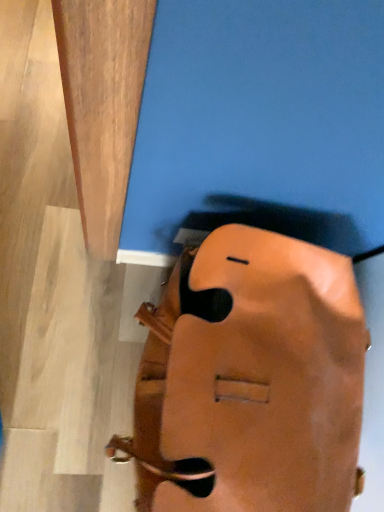
Describe the element at coordinates (250, 380) in the screenshot. I see `leather handbag at lower center` at that location.

What is the approximate height of leather handbag at lower center?

leather handbag at lower center is 17.22 inches tall.

Locate an element on the screen. The width and height of the screenshot is (384, 512). leather handbag at lower center is located at coordinates (250, 380).

This screenshot has height=512, width=384. In order to click on leather handbag at lower center in this screenshot , I will do `click(250, 380)`.